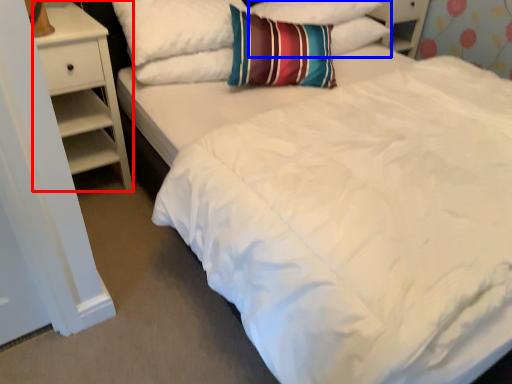
Question: Among these objects, which one is nearest to the camera, nightstand (highlighted by a red box) or pillow (highlighted by a blue box)?

Choices:
 (A) nightstand
 (B) pillow

Answer: (A)